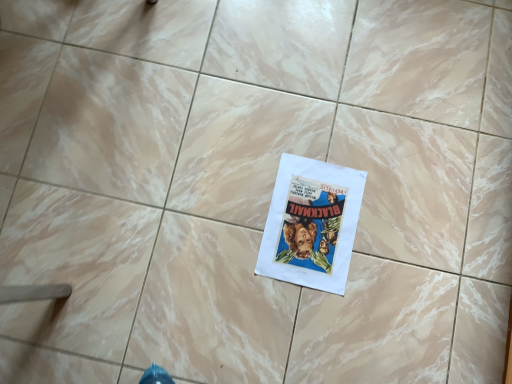
This screenshot has width=512, height=384. Find the location of `white paper poster at center`. white paper poster at center is located at coordinates (311, 224).

What do you see at coordinates (311, 224) in the screenshot? This screenshot has height=384, width=512. I see `white paper poster at center` at bounding box center [311, 224].

Identify the location of white paper poster at center. (311, 224).